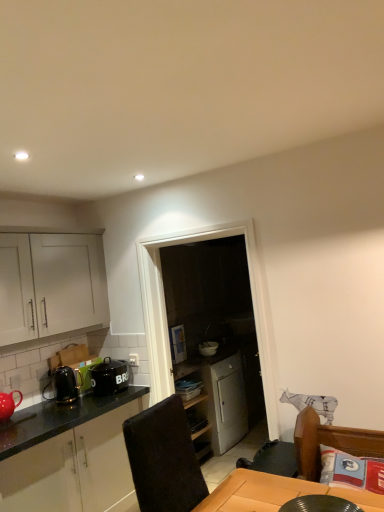
The image size is (384, 512). Describe the element at coordinates (50, 285) in the screenshot. I see `white matte cabinet at left, the third cabinetry positioned from the bottom` at that location.

Measure the distance between shiny black kettle at left, the second appliance viewed from the front, and camera.

The distance of shiny black kettle at left, the second appliance viewed from the front, from camera is 10.39 feet.

The image size is (384, 512). In order to click on white glossy cabinet at left, the 3th cabinetry from the top in this screenshot , I will do `click(74, 468)`.

What do you see at coordinates (8, 404) in the screenshot? I see `matte red teapot at lower left` at bounding box center [8, 404].

Identify the location of brown leather swivel chair at lower right. (330, 442).

From the picture: Is white glossy bowl at center, which is the 2th appliance from left to right, oriented away from satin white cabinet at center, which is counted as the second cabinetry, starting from the top?

No, satin white cabinet at center, which is counted as the second cabinetry, starting from the top, is not at the back of white glossy bowl at center, which is the 2th appliance from left to right.

Which of these two, white glossy bowl at center, acting as the second appliance starting from the right, or satin white cabinet at center, which is counted as the second cabinetry, starting from the top, stands shorter?

Standing shorter between the two is white glossy bowl at center, acting as the second appliance starting from the right.

How different are the orientations of white glossy bowl at center, which is counted as the 1th appliance, starting from the back, and satin white cabinet at center, the 2th cabinetry when ordered from bottom to top, in degrees?

0.356 degrees.

From the image's perspective, starting from the satin white cabinet at center, the 2th cabinetry when ordered from bottom to top, which appliance is the 1st one above? Please provide its 2D coordinates.

[(208, 348)]

This screenshot has height=512, width=384. Find the location of `swivel chair on the right of white glossy bowl at center, which is the 2th appliance from left to right`. swivel chair on the right of white glossy bowl at center, which is the 2th appliance from left to right is located at coordinates (330, 442).

Who is taller, brown leather swivel chair at lower right or white glossy bowl at center, which is the 2th appliance from left to right?

With more height is brown leather swivel chair at lower right.

Is brown leather swivel chair at lower right oriented away from white glossy bowl at center, which is counted as the 1th appliance, starting from the back?

No, white glossy bowl at center, which is counted as the 1th appliance, starting from the back, is not at the back of brown leather swivel chair at lower right.

Are brown leather swivel chair at lower right and white glossy bowl at center, which is counted as the 1th appliance, starting from the back, making contact?

No.

From a real-world perspective, is white glossy cabinet at left, which is the 1th cabinetry from bottom to top, physically located above or below white matte cabinet at left, the third cabinetry positioned from the bottom?

white glossy cabinet at left, which is the 1th cabinetry from bottom to top, is below white matte cabinet at left, the third cabinetry positioned from the bottom.

From the image's perspective, is white glossy cabinet at left, the 3th cabinetry from the top, below white matte cabinet at left, the third cabinetry positioned from the bottom?

Indeed, from the image's perspective, white glossy cabinet at left, the 3th cabinetry from the top, is shown beneath white matte cabinet at left, the third cabinetry positioned from the bottom.

Considering the sizes of white glossy cabinet at left, the 3th cabinetry from the top, and white matte cabinet at left, acting as the first cabinetry starting from the top, in the image, is white glossy cabinet at left, the 3th cabinetry from the top, wider or thinner than white matte cabinet at left, acting as the first cabinetry starting from the top,?

Clearly, white glossy cabinet at left, the 3th cabinetry from the top, has more width compared to white matte cabinet at left, acting as the first cabinetry starting from the top.

Which object is positioned more to the left, brown leather swivel chair at lower right or black glossy plate at lower center, which ranks as the 1th appliance in front-to-back order?

Positioned to the left is black glossy plate at lower center, which ranks as the 1th appliance in front-to-back order.

You are a GUI agent. You are given a task and a screenshot of the screen. Output one action in this format:
    pyautogui.click(x=<x>, y=<y>)
    Task: Click on the swivel chair on the right of black glossy plate at lower center, the third appliance positioned from the back
    
    Given the screenshot: What is the action you would take?
    pyautogui.click(x=330, y=442)

From the image's perspective, is brown leather swivel chair at lower right above or below black glossy plate at lower center, positioned as the first appliance in right-to-left order?

From the image's perspective, brown leather swivel chair at lower right appears below black glossy plate at lower center, positioned as the first appliance in right-to-left order.

Considering the sizes of brown leather swivel chair at lower right and black glossy plate at lower center, the 3th appliance when ordered from left to right, in the image, is brown leather swivel chair at lower right taller or shorter than black glossy plate at lower center, the 3th appliance when ordered from left to right,?

brown leather swivel chair at lower right is taller than black glossy plate at lower center, the 3th appliance when ordered from left to right.

From the image's perspective, which is below, white glossy cabinet at left, the 3th cabinetry from the top, or brown leather swivel chair at lower right?

white glossy cabinet at left, the 3th cabinetry from the top, appears lower in the image.

Are white glossy cabinet at left, the 3th cabinetry from the top, and brown leather swivel chair at lower right making contact?

No, white glossy cabinet at left, the 3th cabinetry from the top, is not beside brown leather swivel chair at lower right.

Considering the positions of objects white glossy cabinet at left, the 3th cabinetry from the top, and brown leather swivel chair at lower right in the image provided, who is more to the left, white glossy cabinet at left, the 3th cabinetry from the top, or brown leather swivel chair at lower right?

Positioned to the left is white glossy cabinet at left, the 3th cabinetry from the top.

From a real-world perspective, does white glossy cabinet at left, the 3th cabinetry from the top, stand above brown leather swivel chair at lower right?

No, from a real-world perspective, white glossy cabinet at left, the 3th cabinetry from the top, is not on top of brown leather swivel chair at lower right.

Is satin white cabinet at center, which is counted as the second cabinetry, starting from the top, shorter than white matte cabinet at left, acting as the first cabinetry starting from the top?

No.

Based on the photo, from a real-world perspective, is satin white cabinet at center, which is counted as the second cabinetry, starting from the top, beneath white matte cabinet at left, the third cabinetry positioned from the bottom?

Yes, from a real-world perspective, satin white cabinet at center, which is counted as the second cabinetry, starting from the top, is below white matte cabinet at left, the third cabinetry positioned from the bottom.

Are satin white cabinet at center, the 2th cabinetry when ordered from bottom to top, and white matte cabinet at left, acting as the first cabinetry starting from the top, far apart?

That's right, there is a large distance between satin white cabinet at center, the 2th cabinetry when ordered from bottom to top, and white matte cabinet at left, acting as the first cabinetry starting from the top.

Can you confirm if white glossy cabinet at left, the 3th cabinetry from the top, is positioned to the right of white glossy bowl at center, which is counted as the 1th appliance, starting from the back?

In fact, white glossy cabinet at left, the 3th cabinetry from the top, is to the left of white glossy bowl at center, which is counted as the 1th appliance, starting from the back.

From the image's perspective, which is above, white glossy cabinet at left, which is the 1th cabinetry from bottom to top, or white glossy bowl at center, placed as the 3th appliance when sorted from front to back?

white glossy bowl at center, placed as the 3th appliance when sorted from front to back, appears higher in the image.

Is white glossy bowl at center, acting as the second appliance starting from the right, inside white glossy cabinet at left, the 3th cabinetry from the top?

Actually, white glossy bowl at center, acting as the second appliance starting from the right, is outside white glossy cabinet at left, the 3th cabinetry from the top.

Is white glossy cabinet at left, the 3th cabinetry from the top, touching white glossy bowl at center, placed as the 3th appliance when sorted from front to back?

white glossy cabinet at left, the 3th cabinetry from the top, and white glossy bowl at center, placed as the 3th appliance when sorted from front to back, are not in contact.

From the image's perspective, which cabinetry is the 1st one below the white glossy bowl at center, which is counted as the 1th appliance, starting from the back? Please provide its 2D coordinates.

[(222, 397)]

This screenshot has height=512, width=384. I want to click on swivel chair in front of the white glossy bowl at center, which is the 2th appliance from left to right, so click(330, 442).

When comparing their distances from matte red teapot at lower left, does shiny black kettle at left, the second appliance viewed from the front, or satin white cabinet at center, which is counted as the second cabinetry, starting from the top, seem further?

satin white cabinet at center, which is counted as the second cabinetry, starting from the top, lies further to matte red teapot at lower left than the other object.

Looking at the image, which one is located further to black glossy plate at lower center, the 3th appliance when ordered from left to right, matte red teapot at lower left or white glossy bowl at center, which is the 2th appliance from left to right?

A: Among the two, white glossy bowl at center, which is the 2th appliance from left to right, is located further to black glossy plate at lower center, the 3th appliance when ordered from left to right.

Considering their positions, is satin white cabinet at center, the 2th cabinetry when ordered from bottom to top, positioned closer to white matte cabinet at left, acting as the first cabinetry starting from the top, than black glossy plate at lower center, the 3th appliance when ordered from left to right?

satin white cabinet at center, the 2th cabinetry when ordered from bottom to top, is closer to white matte cabinet at left, acting as the first cabinetry starting from the top.

Looking at the image, which one is located closer to white matte cabinet at left, acting as the first cabinetry starting from the top, black glossy plate at lower center, positioned as the first appliance in right-to-left order, or satin white cabinet at center, the 2th cabinetry when ordered from bottom to top?

satin white cabinet at center, the 2th cabinetry when ordered from bottom to top.

When comparing their distances from white glossy bowl at center, which is the 2th appliance from left to right, does black glossy plate at lower center, the 3th appliance when ordered from left to right, or white glossy cabinet at left, the 3th cabinetry from the top, seem further?

The object further to white glossy bowl at center, which is the 2th appliance from left to right, is black glossy plate at lower center, the 3th appliance when ordered from left to right.

Based on their spatial positions, is satin white cabinet at center, which is counted as the second cabinetry, starting from the top, or white matte cabinet at left, the third cabinetry positioned from the bottom, further from matte red teapot at lower left?

satin white cabinet at center, which is counted as the second cabinetry, starting from the top, is positioned further to the anchor matte red teapot at lower left.

When comparing their distances from satin white cabinet at center, the 2th cabinetry when ordered from bottom to top, does white glossy bowl at center, placed as the 3th appliance when sorted from front to back, or black ceramic pot at left seem closer?

Among the two, white glossy bowl at center, placed as the 3th appliance when sorted from front to back, is located nearer to satin white cabinet at center, the 2th cabinetry when ordered from bottom to top.

When comparing their distances from white glossy bowl at center, acting as the second appliance starting from the right, does white matte cabinet at left, acting as the first cabinetry starting from the top, or satin white cabinet at center, the 2th cabinetry when ordered from bottom to top, seem further?

Among the two, white matte cabinet at left, acting as the first cabinetry starting from the top, is located further to white glossy bowl at center, acting as the second appliance starting from the right.

The image size is (384, 512). I want to click on tea pot between black glossy plate at lower center, positioned as the first appliance in right-to-left order, and satin white cabinet at center, which is counted as the second cabinetry, starting from the top, along the z-axis, so click(x=8, y=404).

Find the location of a particular element. The width and height of the screenshot is (384, 512). kitchen appliance between matte red teapot at lower left and brown leather swivel chair at lower right is located at coordinates (109, 377).

I want to click on kitchen appliance between shiny black kettle at left, the second appliance viewed from the front, and white glossy bowl at center, which is counted as the 1th appliance, starting from the back, along the z-axis, so click(x=109, y=377).

This screenshot has height=512, width=384. I want to click on appliance between brown leather swivel chair at lower right and white glossy bowl at center, placed as the 3th appliance when sorted from front to back, in the front-back direction, so click(63, 386).